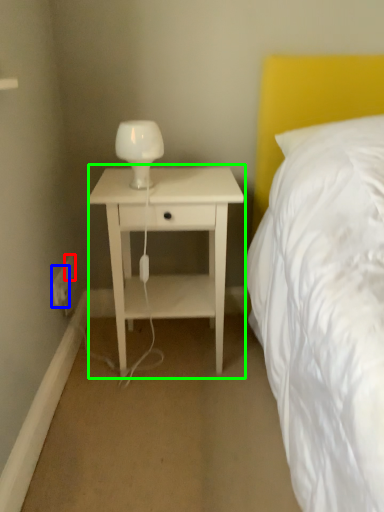
Question: Considering the real-world distances, which object is farthest from electric outlet (highlighted by a red box)? electric outlet (highlighted by a blue box) or nightstand (highlighted by a green box)?

Choices:
 (A) electric outlet
 (B) nightstand

Answer: (B)